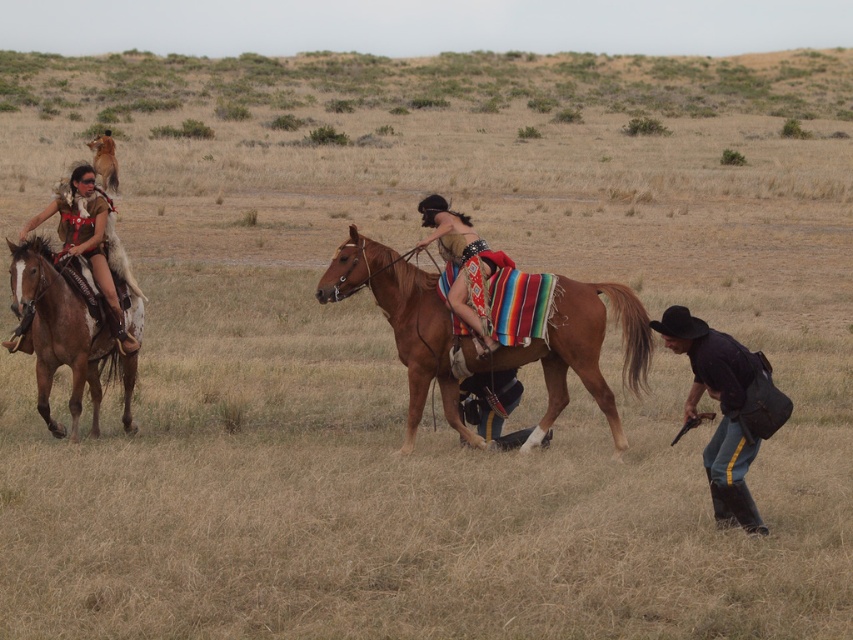
Question: Which point is closer to the camera taking this photo?

Choices:
 (A) (468, 221)
 (B) (688, 344)
 (C) (625, 353)
 (D) (61, 316)

Answer: (B)

Question: Is matte brown leather horse at left further to camera compared to brown leather horse at upper left?

Choices:
 (A) no
 (B) yes

Answer: (A)

Question: Where is brown leather horse at left located in relation to matte brown leather horse at left in the image?

Choices:
 (A) left
 (B) right

Answer: (A)

Question: Which is nearer to the brown leather horse at left?

Choices:
 (A) brown leather horse at center
 (B) black leather cowboy hat at lower right

Answer: (A)

Question: Does matte brown leather horse at left appear under leather vest at center?

Choices:
 (A) no
 (B) yes

Answer: (B)

Question: Estimate the real-world distances between objects in this image. Which object is closer to the leather vest at center?

Choices:
 (A) black leather cowboy hat at lower right
 (B) matte brown leather horse at left
 (C) brown leather horse at center

Answer: (C)